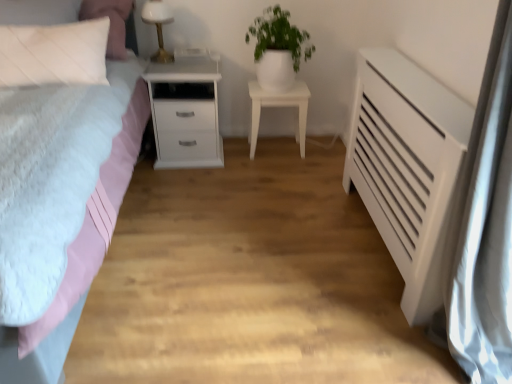
This screenshot has width=512, height=384. What are the coordinates of `blank space to the left of white matte radiator at right` in the screenshot? It's located at (333, 321).